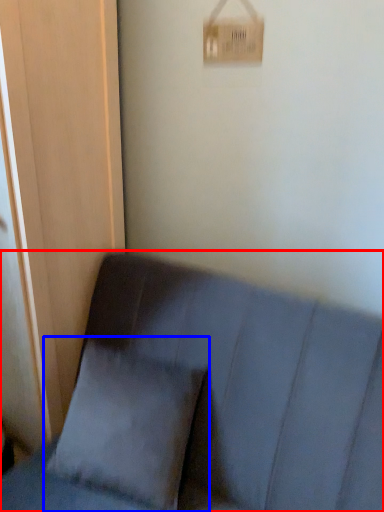
Question: Which of the following is the farthest to the observer, furniture (highlighted by a red box) or pillow (highlighted by a blue box)?

Choices:
 (A) furniture
 (B) pillow

Answer: (B)